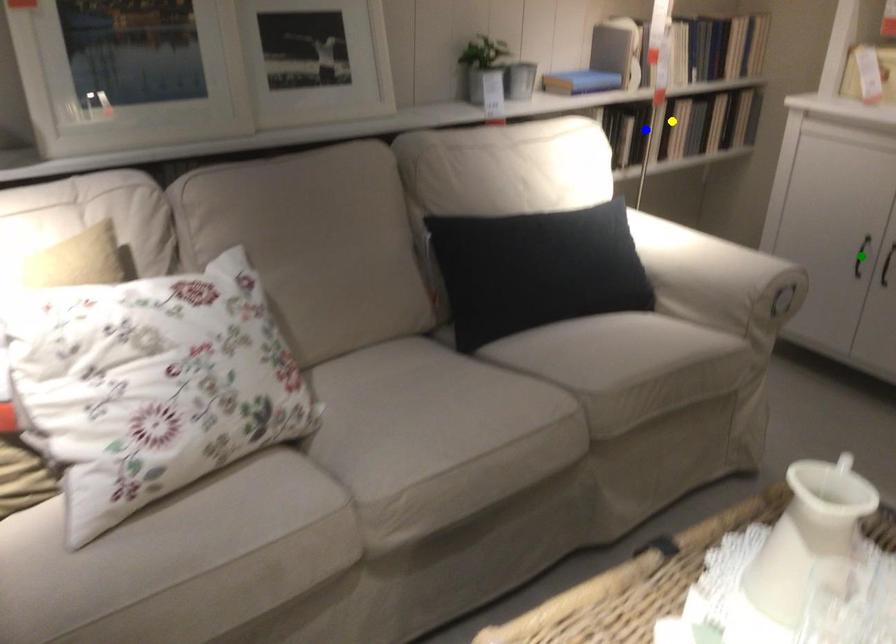
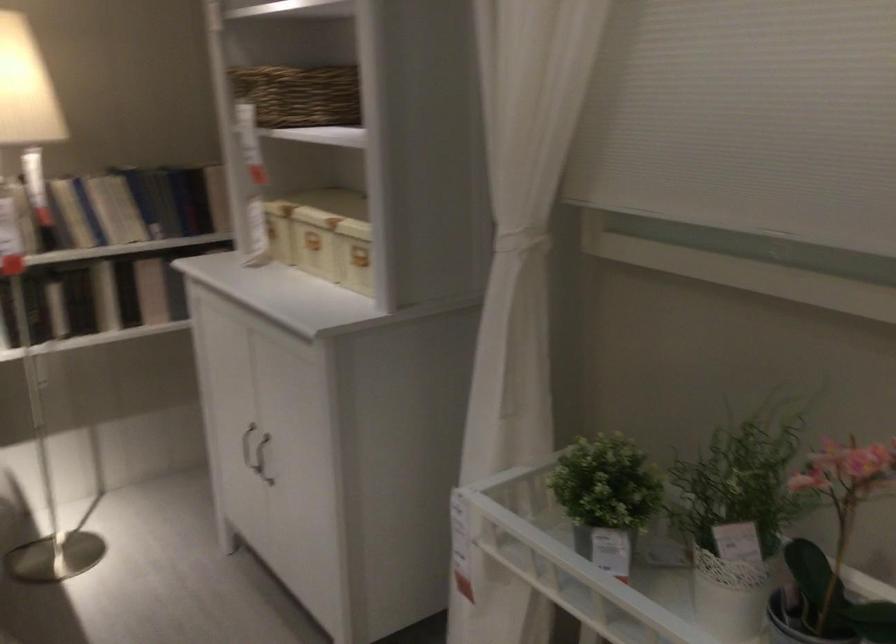
I am providing you with two images of the same scene from different viewpoints. Three points are marked in image1. Which point corresponds to a part or object that is occluded in image2?In image1, three points are marked. Which of them correspond to a part or object that is occluded in image2?Among the three points shown in image1, which one corresponds to a part or object that is no longer visible due to occlusion in image2?

green point cannot be seen in image2.